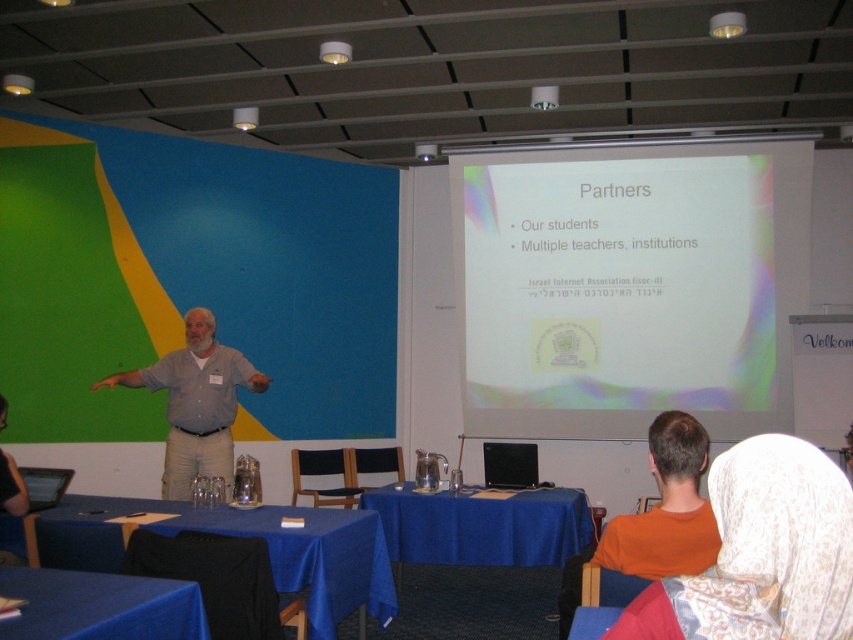
Based on the scene description, which object is positioned to the left of the other? The white matte projector screen at upper center or the white lace headscarf at upper right?

The white lace headscarf at upper right is to the left of the white matte projector screen at upper center.

You are attending a presentation and want to take a photo of the white matte projector screen at upper center and the white lace headscarf at upper right. Which object should you focus on first if you want to capture both in one frame without moving the camera?

The white lace headscarf at upper right should be focused on first because the white matte projector screen at upper center is much taller, so adjusting focus to the closer object first would ensure both are in the frame.